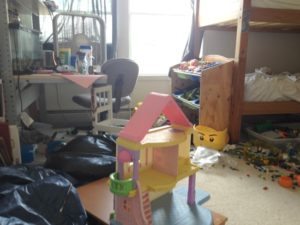
You are a GUI agent. You are given a task and a screenshot of the screen. Output one action in this format:
    pyautogui.click(x=<x>, y=<y>)
    Task: Click on the chair
    The width and height of the screenshot is (300, 225).
    Given the screenshot: What is the action you would take?
    pyautogui.click(x=100, y=116)